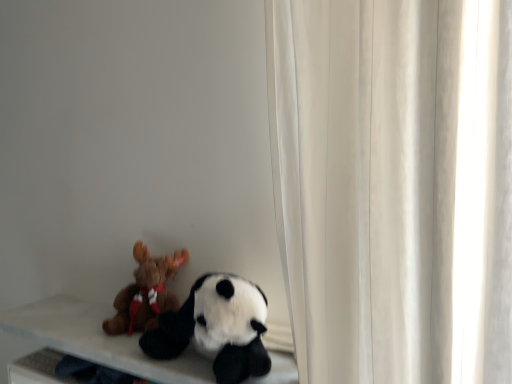
Question: Can you confirm if soft white table at lower left is bigger than soft plush panda at lower left, placed as the 2th toy when sorted from left to right?

Choices:
 (A) yes
 (B) no

Answer: (A)

Question: Can you confirm if soft white table at lower left is positioned to the left of soft plush panda at lower left, arranged as the first toy when viewed from the right?

Choices:
 (A) yes
 (B) no

Answer: (A)

Question: Does soft white table at lower left come behind soft plush panda at lower left, arranged as the first toy when viewed from the right?

Choices:
 (A) yes
 (B) no

Answer: (A)

Question: Is soft white table at lower left oriented away from soft plush panda at lower left, placed as the 2th toy when sorted from left to right?

Choices:
 (A) yes
 (B) no

Answer: (B)

Question: Does soft white table at lower left have a lesser width compared to soft plush panda at lower left, arranged as the first toy when viewed from the right?

Choices:
 (A) no
 (B) yes

Answer: (A)

Question: Is soft white table at lower left positioned far away from soft plush panda at lower left, placed as the 2th toy when sorted from left to right?

Choices:
 (A) no
 (B) yes

Answer: (A)

Question: Is soft plush panda at lower left, placed as the 2th toy when sorted from left to right, positioned with its back to soft white table at lower left?

Choices:
 (A) yes
 (B) no

Answer: (B)

Question: Considering the relative sizes of soft plush panda at lower left, placed as the 2th toy when sorted from left to right, and soft white table at lower left in the image provided, is soft plush panda at lower left, placed as the 2th toy when sorted from left to right, bigger than soft white table at lower left?

Choices:
 (A) no
 (B) yes

Answer: (A)

Question: Is soft plush panda at lower left, placed as the 2th toy when sorted from left to right, positioned far away from soft white table at lower left?

Choices:
 (A) no
 (B) yes

Answer: (A)

Question: Is soft white table at lower left located within soft plush panda at lower left, arranged as the first toy when viewed from the right?

Choices:
 (A) yes
 (B) no

Answer: (B)

Question: From a real-world perspective, is soft plush panda at lower left, placed as the 2th toy when sorted from left to right, positioned under soft white table at lower left based on gravity?

Choices:
 (A) no
 (B) yes

Answer: (A)

Question: Is soft plush panda at lower left, arranged as the first toy when viewed from the right, at the left side of soft white table at lower left?

Choices:
 (A) no
 (B) yes

Answer: (A)

Question: Can you confirm if brown plush moose at left, the 2th toy when ordered from right to left, is taller than soft white table at lower left?

Choices:
 (A) no
 (B) yes

Answer: (B)